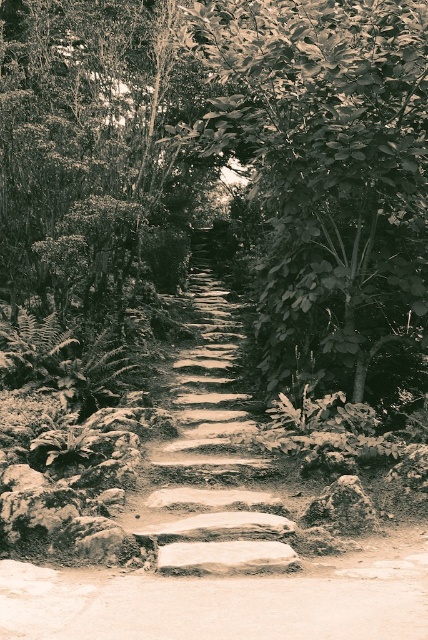
You are a hiker carrying a backpack and want to step onto the path. Which object, the smooth stone steps at center or the smooth gray rock at lower right, has a wider surface to place your foot comfortably?

The smooth stone steps at center has a wider surface than the smooth gray rock at lower right, so you can place your foot comfortably on the smooth stone steps at center.

In the scene shown: You are a landscape architect designing a garden. You want to place a small decorative fountain between the leathery green leafy tree at center and the smooth stone steps at center. Which object should the fountain be closer to, the one that takes up more space or the one that takes up less space?

The fountain should be closer to the smooth stone steps at center because the leathery green leafy tree at center occupies less space, meaning the smooth stone steps at center takes up more space and would require more spacing around it.